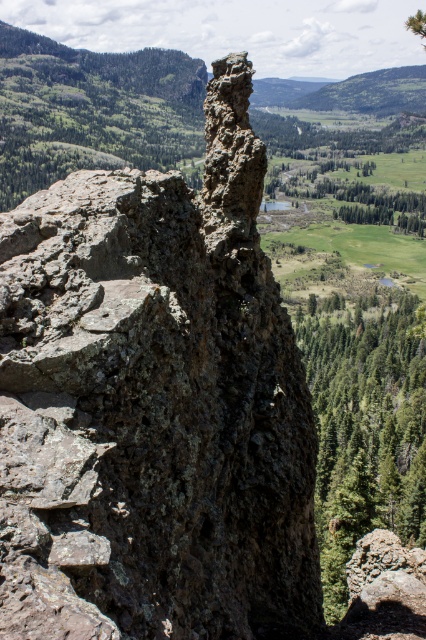
Can you confirm if rusty stone rock at center is bigger than green textured tree at right?

Actually, rusty stone rock at center might be smaller than green textured tree at right.

From the picture: Is rusty stone rock at center to the right of green textured tree at right from the viewer's perspective?

In fact, rusty stone rock at center is to the left of green textured tree at right.

Where is `rusty stone rock at center`? rusty stone rock at center is located at coordinates coord(154,404).

Where is `rusty stone rock at center`? This screenshot has width=426, height=640. rusty stone rock at center is located at coordinates (154, 404).